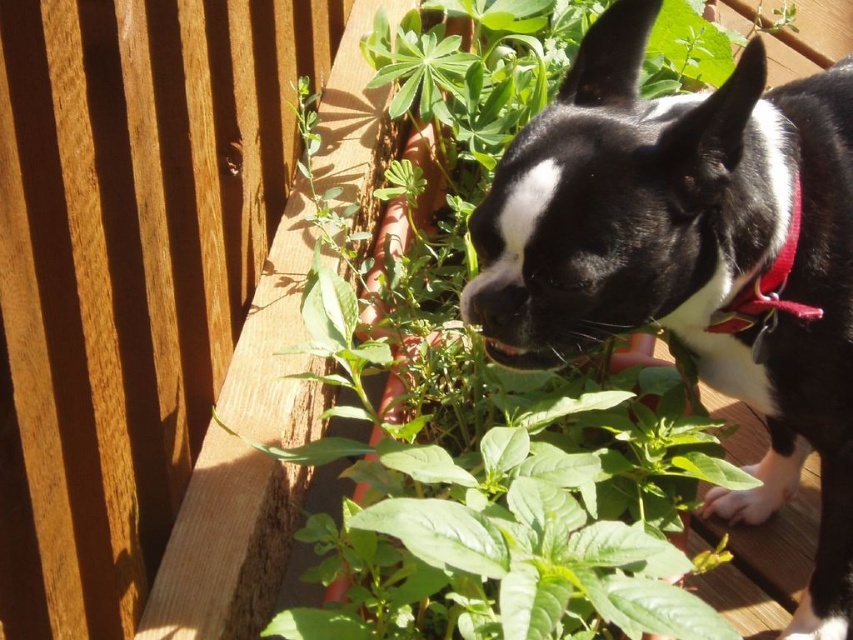
You are a gardener who wants to place a new plant pot between the black matte dog at center and the red fabric neckband at upper right. Based on their positions, where should the pot be placed?

The black matte dog at center is positioned under the red fabric neckband at upper right, so the plant pot should be placed between them horizontally, below the red fabric neckband at upper right and above the black matte dog at center.

From the picture: You are standing at the origin point in the image and see two points marked as point (589, 248) and point (782, 298). Which point is closer to you?

Point (589, 248) is in front of point (782, 298), so it is closer to you.

You are a photographer trying to capture the black matte dog at center and the red fabric neckband at upper right in a single frame. Which object will appear wider in the photo?

The black matte dog at center will appear wider in the photo since its width surpasses that of the red fabric neckband at upper right.